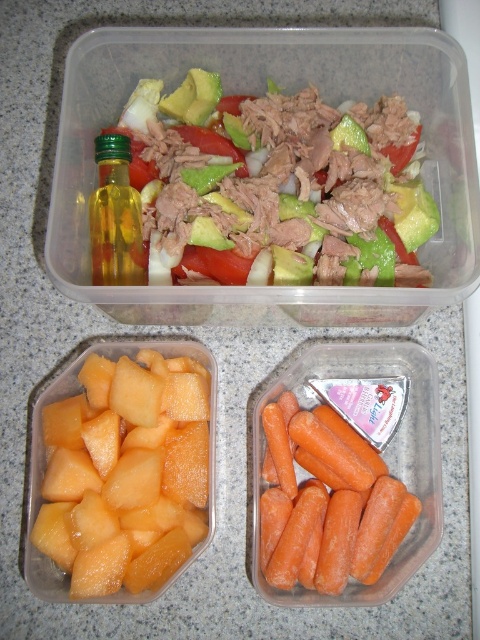
Question: Estimate the real-world distances between objects in this image. Which object is closer to the shiny green avocado at upper center?

Choices:
 (A) yellow matte melon at lower left
 (B) orange smooth carrot at lower right

Answer: (A)

Question: Which of the following is the farthest from the observer?

Choices:
 (A) (325, 157)
 (B) (119, 557)
 (C) (286, 573)

Answer: (A)

Question: Which of these objects is positioned farthest from the shiny green avocado at upper center?

Choices:
 (A) orange smooth carrot at lower right
 (B) yellow matte melon at lower left

Answer: (A)

Question: Can you confirm if shiny green avocado at upper center is bigger than yellow matte melon at lower left?

Choices:
 (A) no
 (B) yes

Answer: (B)

Question: Does yellow matte melon at lower left have a lesser width compared to orange smooth carrot at lower right?

Choices:
 (A) yes
 (B) no

Answer: (B)

Question: Can you confirm if shiny green avocado at upper center is positioned below green glass bottle at upper left?

Choices:
 (A) yes
 (B) no

Answer: (B)